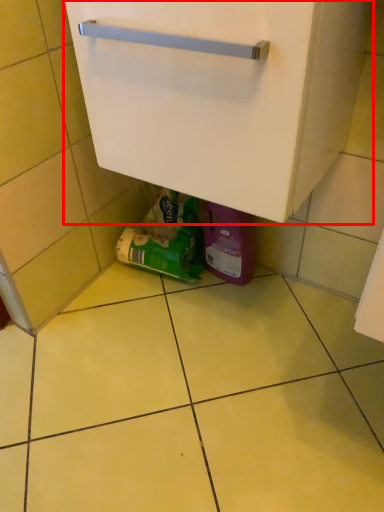
Question: Observing the image, what is the correct spatial positioning of cabinetry (annotated by the red box) in reference to garbage?

Choices:
 (A) right
 (B) left

Answer: (A)